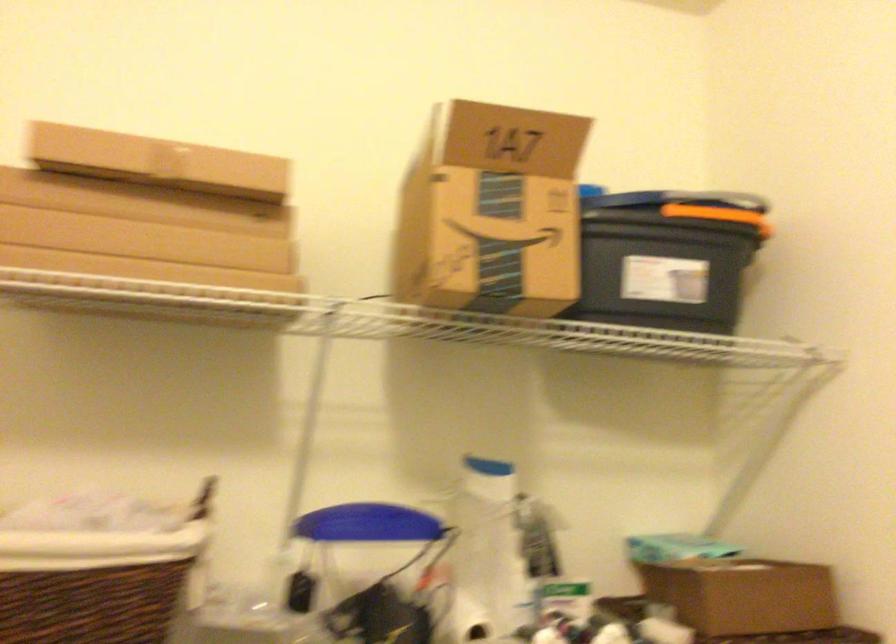
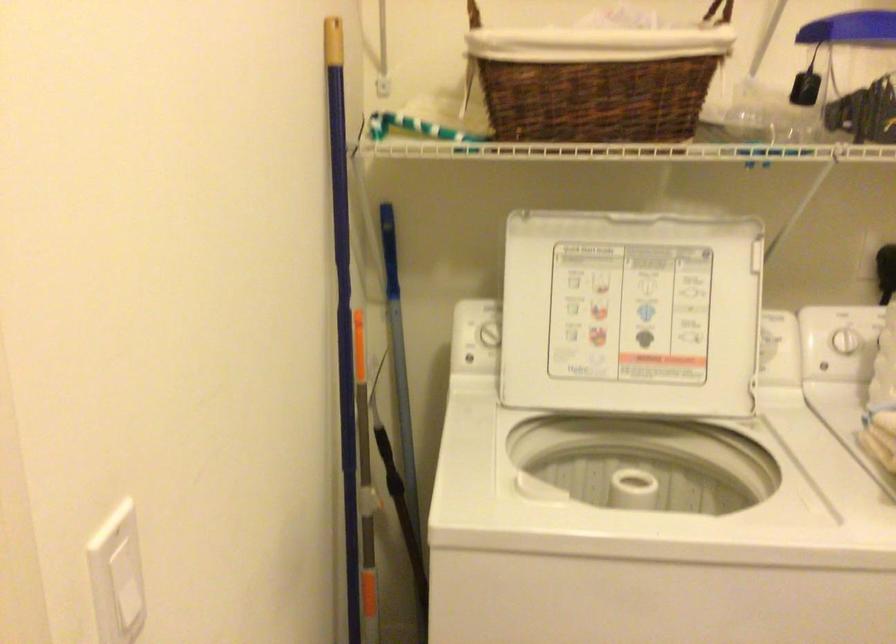
The images are taken continuously from a first-person perspective. In which direction is your viewpoint rotating?

The camera's rotation is toward left-down.